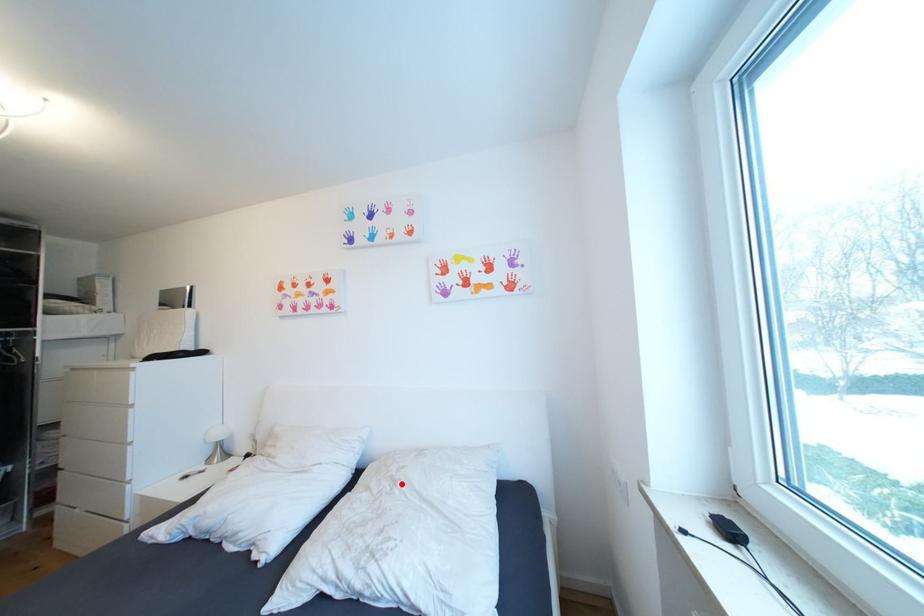
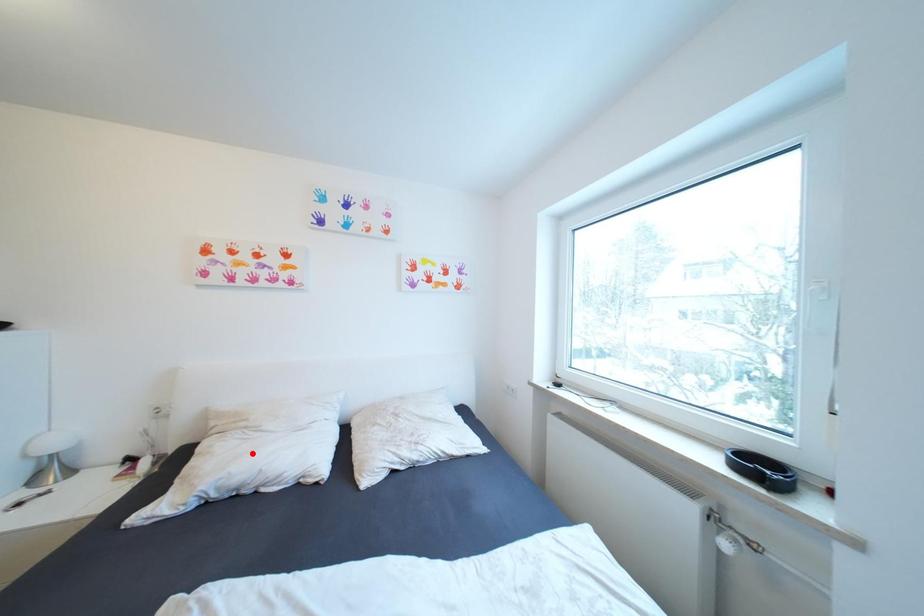
I am providing you with two images of the same scene from different viewpoints. A red point is marked on the first image and another point is marked on the second image. Do the highlighted points in image1 and image2 indicate the same real-world spot?

No